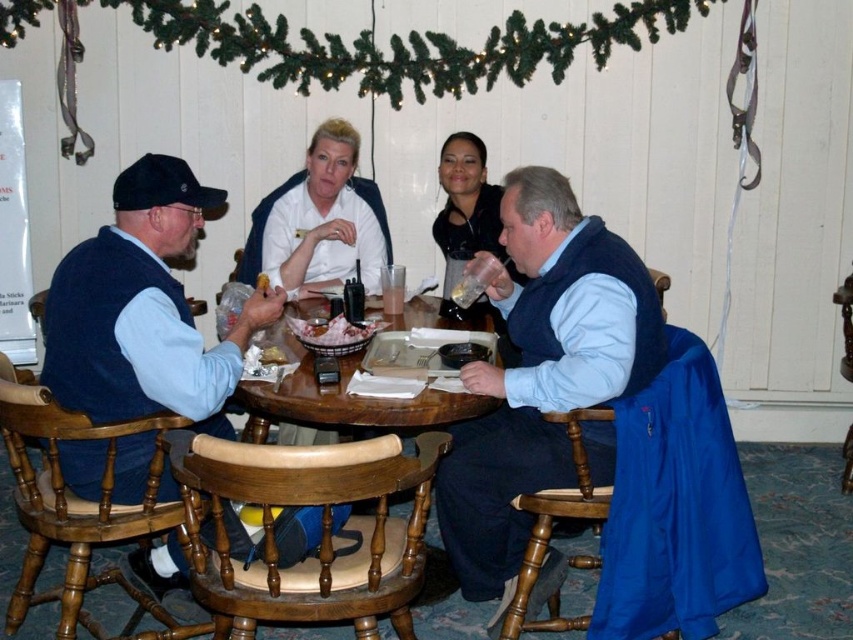
Who is more forward, (302, 237) or (380, 401)?

Point (380, 401)

Is white smooth shirt at center wider than wooden table at center?

In fact, white smooth shirt at center might be narrower than wooden table at center.

Does point (328, 224) come farther from viewer compared to point (370, 417)?

Yes, point (328, 224) is farther from viewer.

The image size is (853, 640). In order to click on white smooth shirt at center in this screenshot , I will do `click(320, 218)`.

What do you see at coordinates (332, 332) in the screenshot? I see `matte brown basket at center` at bounding box center [332, 332].

At what (x,y) coordinates should I click in order to perform the action: click on matte brown basket at center. Please return your answer as a coordinate pair (x, y). This screenshot has height=640, width=853. Looking at the image, I should click on (332, 332).

Find the location of a particular element. The width and height of the screenshot is (853, 640). matte brown basket at center is located at coordinates (332, 332).

Based on the photo, can you confirm if translucent plastic cup at center is positioned to the right of yellow crumbly cake at center?

Indeed, translucent plastic cup at center is positioned on the right side of yellow crumbly cake at center.

Can you confirm if translucent plastic cup at center is positioned above yellow crumbly cake at center?

→ Actually, translucent plastic cup at center is below yellow crumbly cake at center.

This screenshot has height=640, width=853. Describe the element at coordinates (392, 298) in the screenshot. I see `translucent plastic cup at center` at that location.

Find the location of a particular element. translucent plastic cup at center is located at coordinates (392, 298).